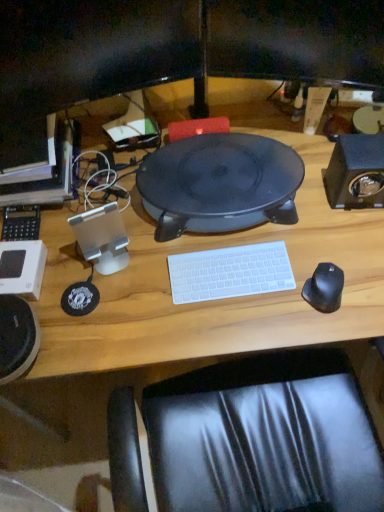
Where is `vacant space in between black matte mouse at right and black matte speaker at right`? Image resolution: width=384 pixels, height=512 pixels. vacant space in between black matte mouse at right and black matte speaker at right is located at coordinates click(x=337, y=244).